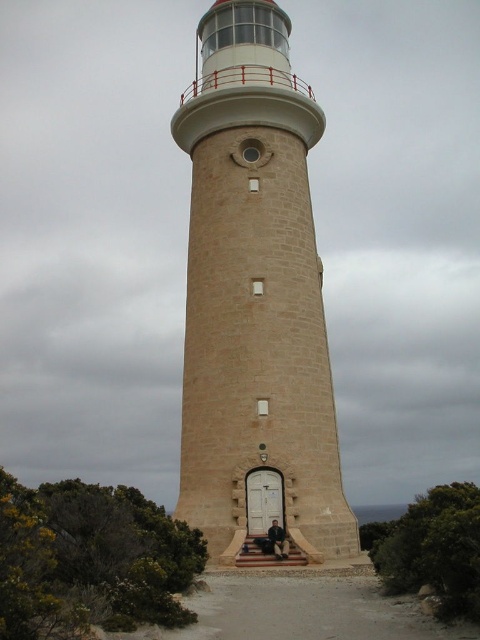
Question: Does beige stone lighthouse at center come behind wooden staircase at center?

Choices:
 (A) no
 (B) yes

Answer: (B)

Question: Which object appears closest to the camera in this image?

Choices:
 (A) wooden staircase at center
 (B) dark brown leather chair at center
 (C) beige stone lighthouse at center

Answer: (A)

Question: Which object appears closest to the camera in this image?

Choices:
 (A) dark brown leather chair at center
 (B) wooden staircase at center
 (C) beige stone lighthouse at center

Answer: (B)

Question: Is beige stone lighthouse at center thinner than wooden staircase at center?

Choices:
 (A) yes
 (B) no

Answer: (B)

Question: Which of these objects is positioned farthest from the dark brown leather chair at center?

Choices:
 (A) beige stone lighthouse at center
 (B) wooden staircase at center

Answer: (A)

Question: Is wooden staircase at center positioned before dark brown leather chair at center?

Choices:
 (A) yes
 (B) no

Answer: (A)